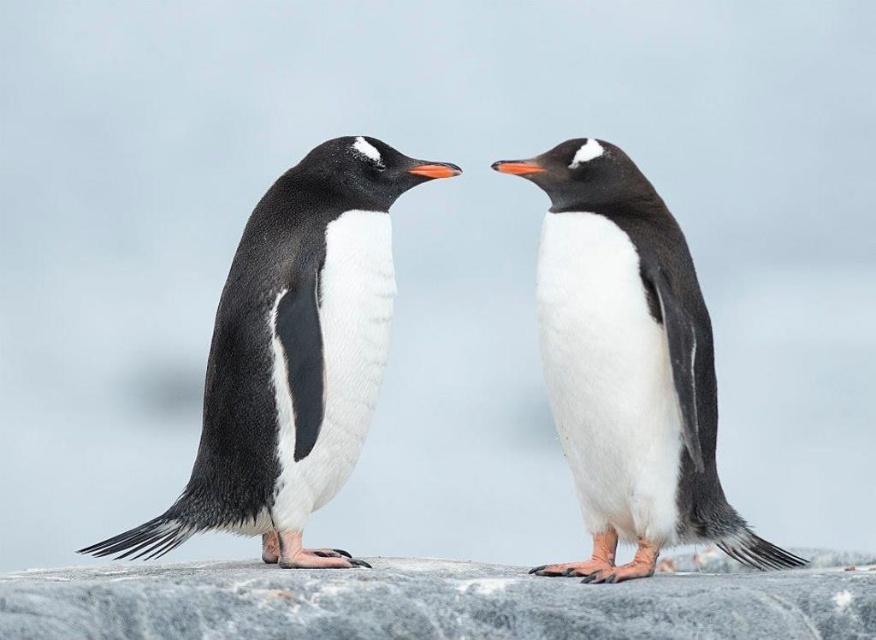
Question: In this image, where is black glossy penguin at left located relative to gray granite rock at center?

Choices:
 (A) left
 (B) right

Answer: (A)

Question: Is black glossy penguin at left further to the viewer compared to gray granite rock at center?

Choices:
 (A) yes
 (B) no

Answer: (A)

Question: Among these points, which one is farthest from the camera?

Choices:
 (A) pyautogui.click(x=571, y=460)
 (B) pyautogui.click(x=267, y=492)

Answer: (A)

Question: Does black glossy penguin at left appear under gray granite rock at center?

Choices:
 (A) yes
 (B) no

Answer: (B)

Question: Which object is the farthest from the white matte penguin at center?

Choices:
 (A) black glossy penguin at left
 (B) gray granite rock at center

Answer: (A)

Question: Which object appears closest to the camera in this image?

Choices:
 (A) gray granite rock at center
 (B) black glossy penguin at left

Answer: (A)